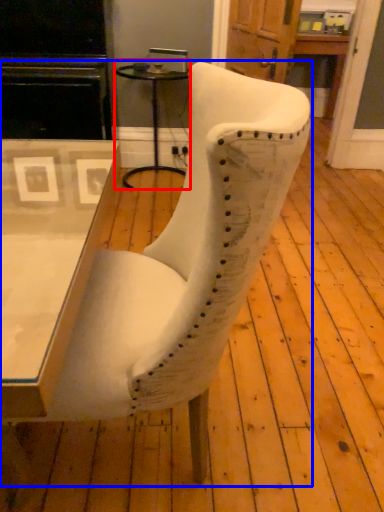
Question: Which object appears closest to the camera in this image, side table (highlighted by a red box) or chair (highlighted by a blue box)?

Choices:
 (A) side table
 (B) chair

Answer: (B)